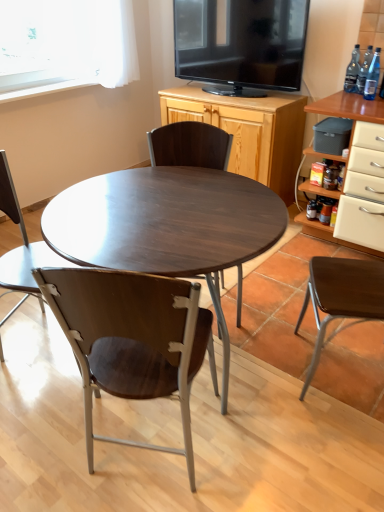
Locate an element on the screen. This screenshot has height=512, width=384. vacant area located to the right-hand side of wooden chair at center, the 3th chair viewed from the right is located at coordinates (275, 451).